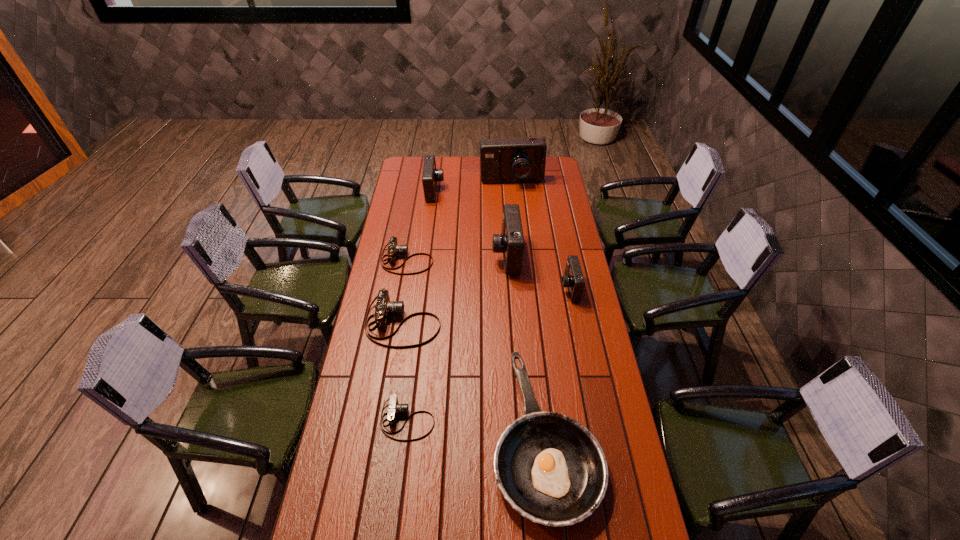
Where is `blank space located on the front-facing side of the smallest blue camera`? blank space located on the front-facing side of the smallest blue camera is located at coordinates (546, 288).

Find the location of a particular element. This screenshot has width=960, height=540. free space located 0.380m on the front-facing side of the smallest blue camera is located at coordinates point(471,288).

Locate an element on the screen. This screenshot has width=960, height=540. vacant space located 0.140m on the front-facing side of the smallest blue camera is located at coordinates (527, 288).

You are a GUI agent. You are given a task and a screenshot of the screen. Output one action in this format:
    pyautogui.click(x=<x>, y=<y>)
    Task: Click on the free point located on the front-facing side of the second farthest brown camera
    The width and height of the screenshot is (960, 540).
    Given the screenshot: What is the action you would take?
    pyautogui.click(x=466, y=323)

The width and height of the screenshot is (960, 540). I want to click on vacant point located on the front-facing side of the second smallest brown camera, so click(490, 260).

Locate an element on the screen. The width and height of the screenshot is (960, 540). free space located 0.280m on the back of the red frying pan is located at coordinates (531, 305).

Where is `free space located on the front-facing side of the nearest brown camera`? The width and height of the screenshot is (960, 540). free space located on the front-facing side of the nearest brown camera is located at coordinates (470, 420).

You are a GUI agent. You are given a task and a screenshot of the screen. Output one action in this format:
    pyautogui.click(x=<x>, y=<y>)
    Task: Click on the object positioned at the far edge
    The image size is (960, 540).
    Given the screenshot: What is the action you would take?
    pyautogui.click(x=522, y=159)

Find the location of `frying pan located in the right edge section of the desktop`. frying pan located in the right edge section of the desktop is located at coordinates (550, 468).

The image size is (960, 540). In order to click on object that is positioned at the far right corner in this screenshot , I will do `click(522, 159)`.